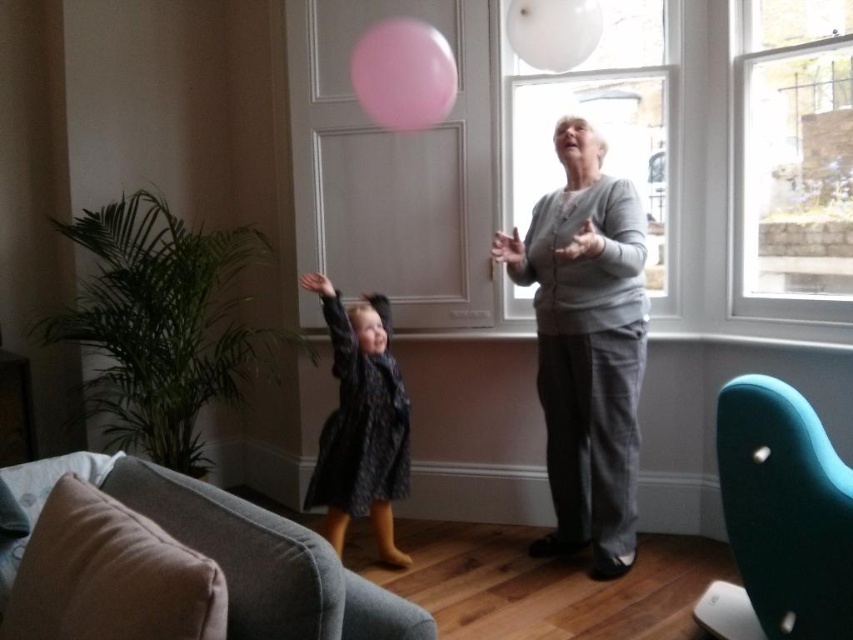
You are a photographer trying to capture a clear shot of the gray cotton sweater at upper center and the white matte balloon at upper center. Which object should you focus on first to ensure both are in focus?

You should focus on the gray cotton sweater at upper center first because it is closer to the viewer than the white matte balloon at upper center. By focusing on the closer object, the balloon will also be in focus due to the depth of field.

You are a delivery person who needs to place a rectangular package that is 1 meter wide. You have to choose between the teal fabric armchair at lower right and the pink rubber balloon at upper center. Which object can accommodate the package without bending or breaking?

The teal fabric armchair at lower right is thinner than the pink rubber balloon at upper center, so the pink rubber balloon at upper center can accommodate the package without bending or breaking.

Based on the scene description, what object is located at the coordinate point (791, 157)?

The clear glass window at upper right is located at the coordinate point (791, 157).